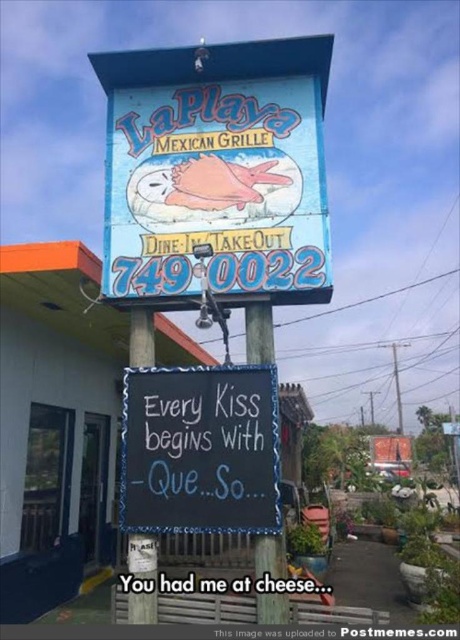
You are a painter who needs to hang a new menu board that is 1.2 meters tall. You have two options on the signboard structure shown in the scene. Which object between the black chalkboard at center and the wooden signpost at center would be more suitable to attach the menu board without it looking too small?

The black chalkboard at center is much taller than the wooden signpost at center, so attaching the 1.2 meters tall menu board to the black chalkboard at center would be more suitable as it provides a proportionate base.

Consider the image. You are standing in front of the La Playa Mexican Grille signboard and notice two points marked on it. The first point is at coordinates point (282,620) and the second is at point (137,620). If you were to draw a straight line between these two points, which point would be closer to the bottom edge of the signboard?

Point (137,620) is closer to the bottom edge of the signboard because it is located lower on the signboard compared to point (282,620).